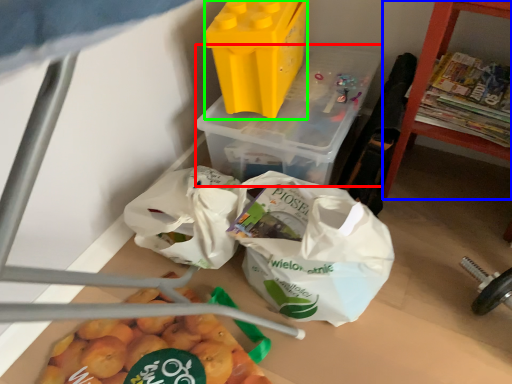
Question: Which object is the closest to the yoghurt (highlighted by a red box)? Choose among these: furniture (highlighted by a blue box) or yoghurt (highlighted by a green box).

Choices:
 (A) furniture
 (B) yoghurt

Answer: (B)